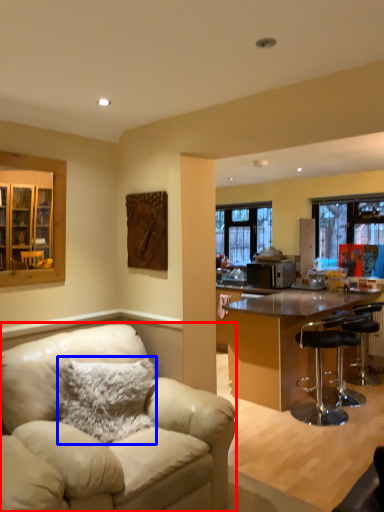
Question: Among these objects, which one is farthest to the camera, chair (highlighted by a red box) or pillow (highlighted by a blue box)?

Choices:
 (A) chair
 (B) pillow

Answer: (B)